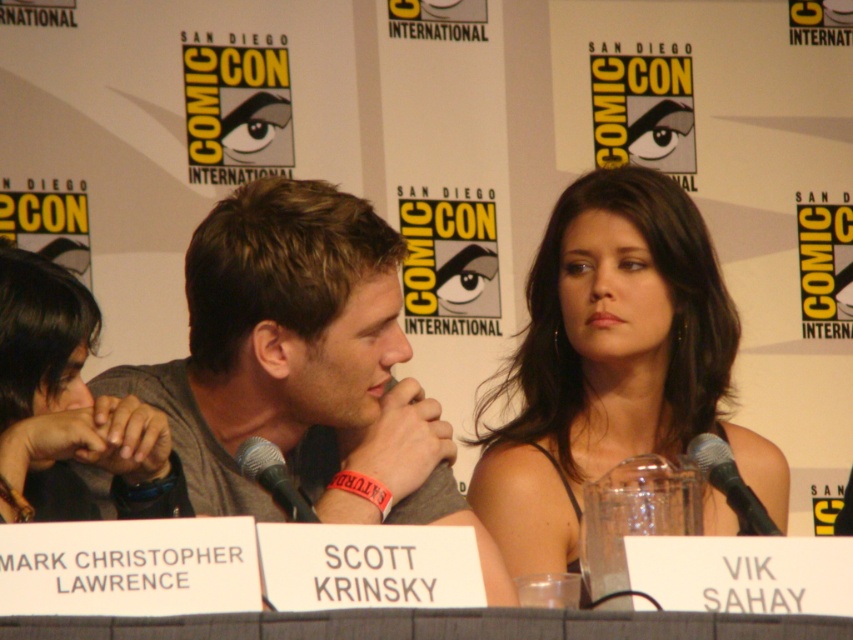
Question: Can you confirm if dark brown hair at center is positioned to the right of black plastic microphone at center?

Choices:
 (A) yes
 (B) no

Answer: (A)

Question: Can you confirm if gray cotton shirt at center is bigger than black metallic microphone at center?

Choices:
 (A) yes
 (B) no

Answer: (A)

Question: Which point appears farthest from the camera in this image?

Choices:
 (A) (708, 444)
 (B) (241, 419)
 (C) (282, 504)
 (D) (181, 470)

Answer: (B)

Question: Which of the following is the closest to the observer?

Choices:
 (A) (714, 442)
 (B) (525, 522)

Answer: (A)

Question: Observing the image, what is the correct spatial positioning of dark brown hair at upper left in reference to black metallic microphone at center?

Choices:
 (A) left
 (B) right

Answer: (A)

Question: Estimate the real-world distances between objects in this image. Which object is closer to the black metallic microphone at center?

Choices:
 (A) black plastic microphone at center
 (B) gray cotton shirt at center
 (C) dark brown hair at upper left
 (D) dark brown hair at center

Answer: (A)